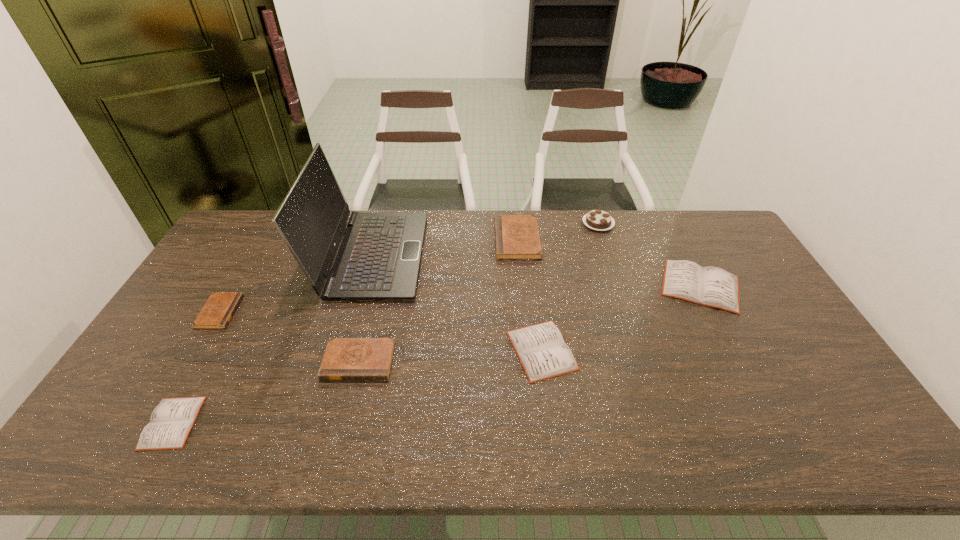
Locate an element on the screen. the second smallest white diary is located at coordinates [x=541, y=349].

Find the location of a particular element. This screenshot has width=960, height=540. the second farthest white diary is located at coordinates (541, 349).

At what (x,y) coordinates should I click in order to perform the action: click on the smallest brown diary. Please return your answer as a coordinate pair (x, y). Looking at the image, I should click on pos(219,309).

Where is `the second farthest brown diary`? This screenshot has width=960, height=540. the second farthest brown diary is located at coordinates (219, 309).

At what (x,y) coordinates should I click in order to perform the action: click on the nearest diary. Please return your answer as a coordinate pair (x, y). Looking at the image, I should click on (171, 421).

Where is `the nearest object`? the nearest object is located at coordinates (171, 421).

Locate an element on the screen. This screenshot has height=540, width=960. blank area located 0.050m on the screen of the tallest object is located at coordinates (437, 255).

This screenshot has height=540, width=960. What are the coordinates of `vacant space situated on the right of the seventh object from left to right` in the screenshot? It's located at (679, 224).

You are a GUI agent. You are given a task and a screenshot of the screen. Output one action in this format:
    pyautogui.click(x=<x>, y=<y>)
    Task: Click on the vacant space located on the spine side of the biggest brown diary
    The width and height of the screenshot is (960, 540).
    Given the screenshot: What is the action you would take?
    pyautogui.click(x=442, y=239)

At what (x,y) coordinates should I click in order to perform the action: click on free spot located 0.100m on the spine side of the biggest brown diary. Please return your answer as a coordinate pair (x, y). The image size is (960, 540). Looking at the image, I should click on (467, 239).